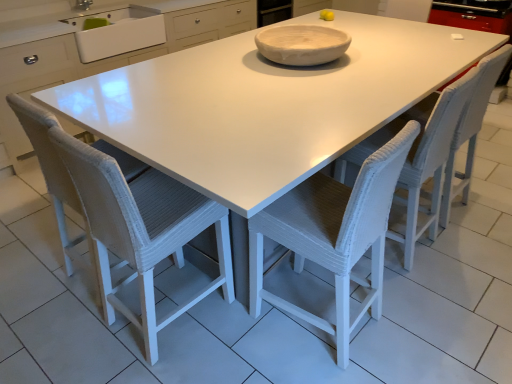
Question: Can you confirm if white ceramic sink at upper left is taller than white woven chair at center, the 1th chair when ordered from right to left?

Choices:
 (A) no
 (B) yes

Answer: (A)

Question: From the image's perspective, is white ceramic sink at upper left located beneath white woven chair at center, which is the third chair in left-to-right order?

Choices:
 (A) no
 (B) yes

Answer: (A)

Question: Is white ceramic sink at upper left outside of white woven chair at center, the 1th chair when ordered from right to left?

Choices:
 (A) yes
 (B) no

Answer: (A)

Question: Considering the relative sizes of white ceramic sink at upper left and white woven chair at center, the 1th chair when ordered from right to left, in the image provided, is white ceramic sink at upper left wider than white woven chair at center, the 1th chair when ordered from right to left,?

Choices:
 (A) no
 (B) yes

Answer: (B)

Question: Can you confirm if white ceramic sink at upper left is bigger than white woven chair at center, the 1th chair when ordered from right to left?

Choices:
 (A) no
 (B) yes

Answer: (A)

Question: Could white woven chair at center, which is the third chair in left-to-right order, be considered to be inside white ceramic sink at upper left?

Choices:
 (A) no
 (B) yes

Answer: (A)

Question: Does white woven chair at center, arranged as the second chair when viewed from the left, lie behind white woven chair at center, the 1th chair when ordered from right to left?

Choices:
 (A) no
 (B) yes

Answer: (A)

Question: Is white woven chair at center, arranged as the second chair when viewed from the left, facing towards white woven chair at center, which is the third chair in left-to-right order?

Choices:
 (A) no
 (B) yes

Answer: (A)

Question: Can you confirm if white woven chair at center, arranged as the second chair when viewed from the left, is positioned to the left of white woven chair at center, which is the third chair in left-to-right order?

Choices:
 (A) no
 (B) yes

Answer: (B)

Question: From the image's perspective, is white woven chair at center, which is the second chair in right-to-left order, under white woven chair at center, which is the third chair in left-to-right order?

Choices:
 (A) no
 (B) yes

Answer: (B)

Question: Does white woven chair at center, which is the second chair in right-to-left order, lie in front of white woven chair at center, which is the third chair in left-to-right order?

Choices:
 (A) no
 (B) yes

Answer: (B)

Question: Considering the relative sizes of white woven chair at center, arranged as the second chair when viewed from the left, and white woven chair at center, the 1th chair when ordered from right to left, in the image provided, is white woven chair at center, arranged as the second chair when viewed from the left, smaller than white woven chair at center, the 1th chair when ordered from right to left,?

Choices:
 (A) no
 (B) yes

Answer: (A)

Question: Considering the relative sizes of white matte bowl at center and white woven chair at center, which appears as the third chair when viewed from the right, in the image provided, is white matte bowl at center wider than white woven chair at center, which appears as the third chair when viewed from the right,?

Choices:
 (A) no
 (B) yes

Answer: (B)